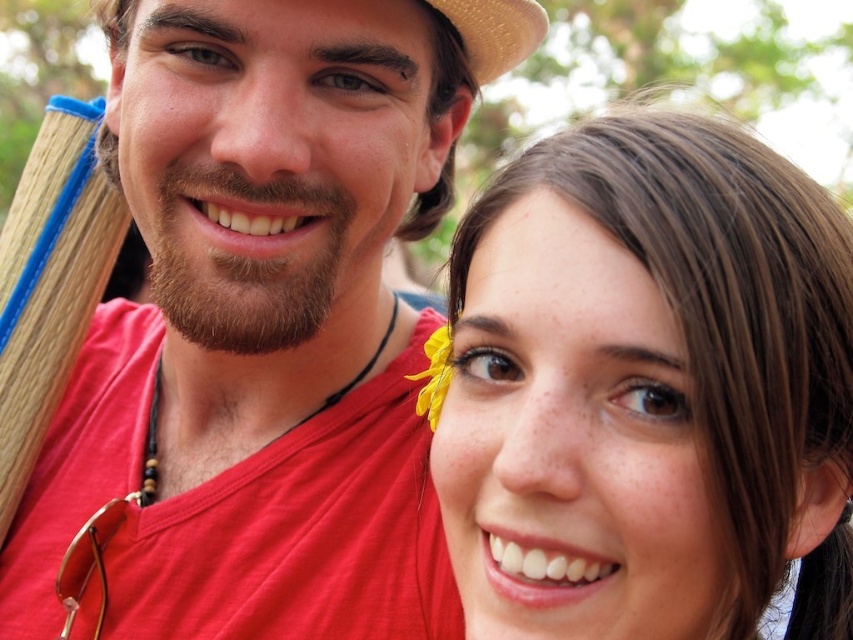
Between matte red shirt at left and smooth brown hair at center, which one appears on the right side from the viewer's perspective?

From the viewer's perspective, smooth brown hair at center appears more on the right side.

How distant is matte red shirt at left from smooth brown hair at center?

matte red shirt at left is 22.53 inches away from smooth brown hair at center.

Does point (161, 250) come in front of point (712, 250)?

No, (161, 250) is further to viewer.

Image resolution: width=853 pixels, height=640 pixels. What are the coordinates of `matte red shirt at left` in the screenshot? It's located at (264, 323).

Between smooth brown hair at center and yellow fabric flower at upper center, which one has more height?

With more height is smooth brown hair at center.

Which is behind, point (663, 474) or point (430, 353)?

Positioned behind is point (430, 353).

Which is behind, point (793, 353) or point (409, 374)?

The point (409, 374) is behind.

Where is `smooth brown hair at center`? smooth brown hair at center is located at coordinates (648, 388).

Does point (204, 582) come in front of point (444, 330)?

No, (204, 582) is behind (444, 330).

Between point (300, 244) and point (438, 394), which one is positioned in front?

Point (438, 394)

Find the location of a particular element. The height and width of the screenshot is (640, 853). matte red shirt at left is located at coordinates (264, 323).